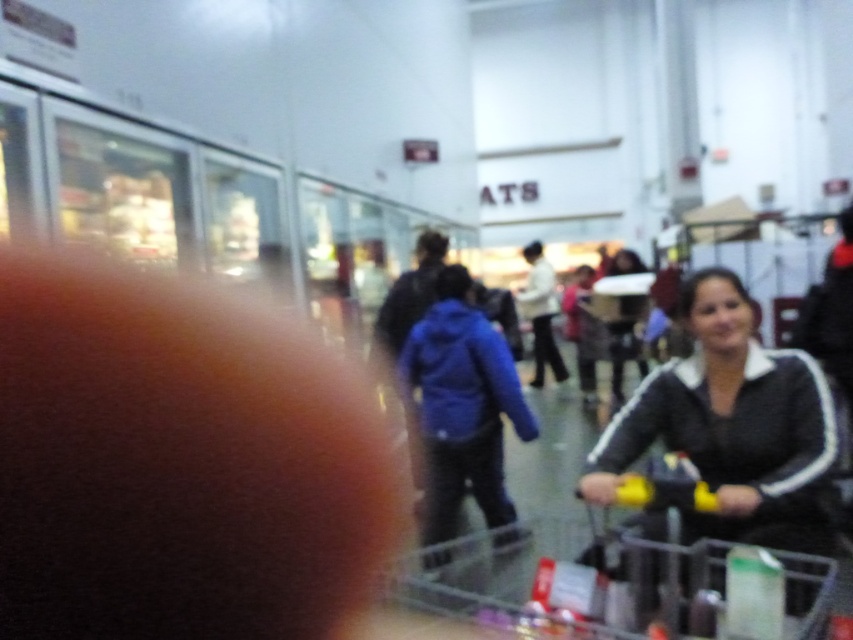
Does black matte jacket at lower right have a smaller size compared to clear plastic shopping cart at lower right?

Yes.

Is black matte jacket at lower right above clear plastic shopping cart at lower right?

Indeed, black matte jacket at lower right is positioned over clear plastic shopping cart at lower right.

Is point (749, 356) more distant than point (532, 624)?

Yes, it is.

Identify the location of black matte jacket at lower right. This screenshot has width=853, height=640. (732, 426).